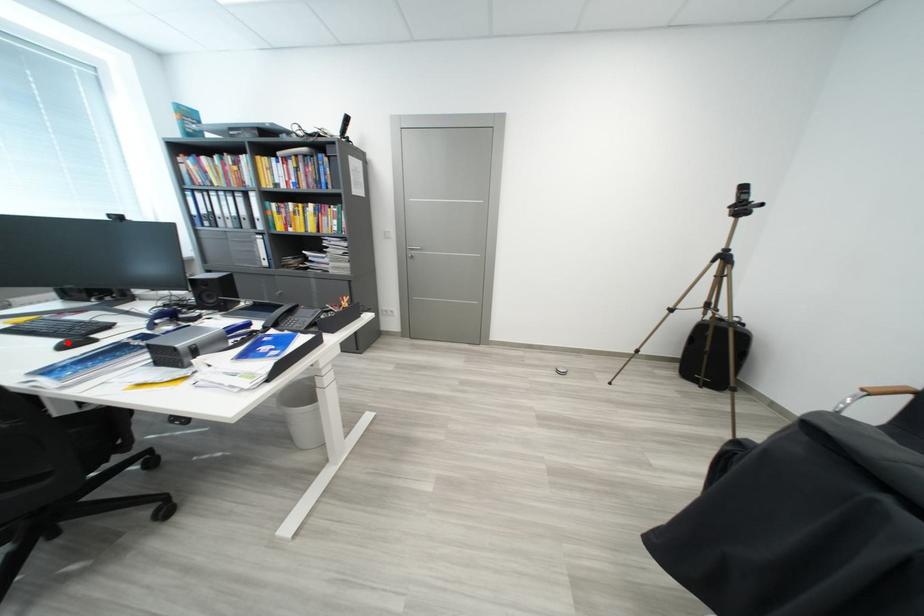
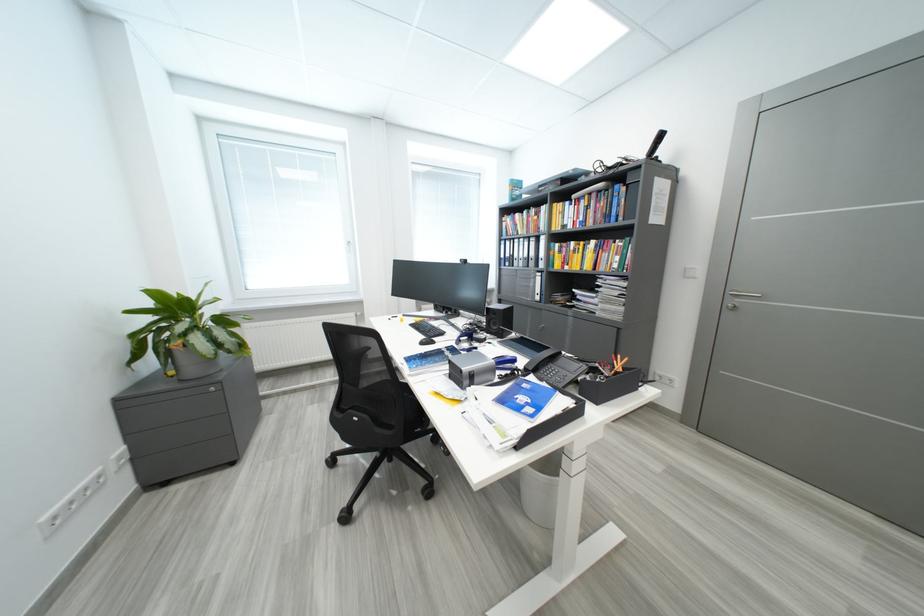
In the second image, find the point that corresponds to the highlighted location in the first image.

(431, 341)